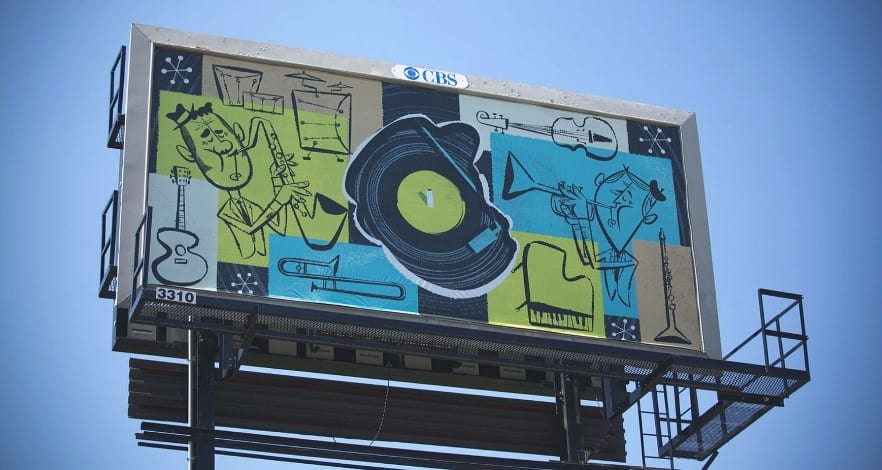
This screenshot has height=470, width=882. What are the coordinates of `ladder` in the screenshot? It's located at (647, 408).